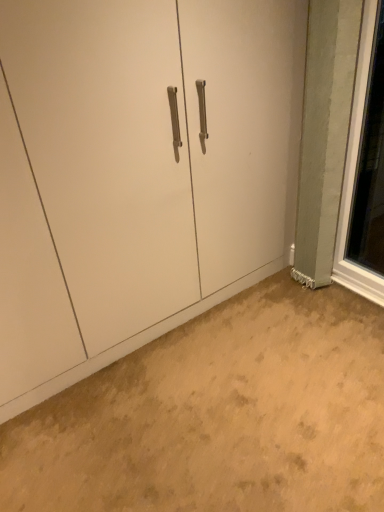
Question: In terms of height, does matte white cabinet at center look taller or shorter compared to clear glass window at right?

Choices:
 (A) short
 (B) tall

Answer: (B)

Question: From a real-world perspective, relative to clear glass window at right, is matte white cabinet at center vertically above or below?

Choices:
 (A) above
 (B) below

Answer: (A)

Question: Which object is the closest to the clear glass window at right?

Choices:
 (A) matte white cabinet at center
 (B) beige carpet at lower center

Answer: (A)

Question: Estimate the real-world distances between objects in this image. Which object is farther from the matte white cabinet at center?

Choices:
 (A) beige carpet at lower center
 (B) clear glass window at right

Answer: (B)